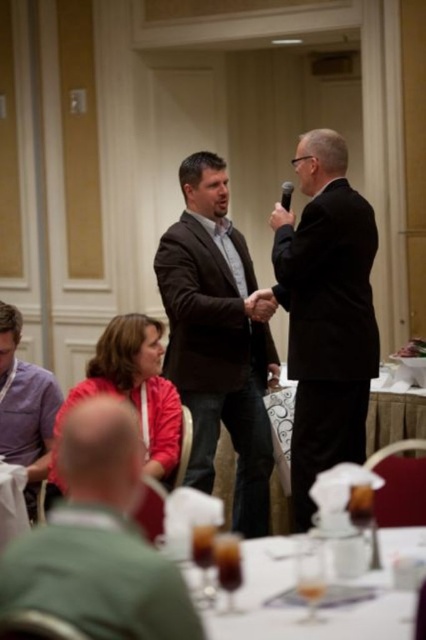
Question: Is green fabric shirt at lower left bigger than white glossy table at center?

Choices:
 (A) yes
 (B) no

Answer: (A)

Question: Which object is farther from the camera taking this photo?

Choices:
 (A) white glossy table at center
 (B) black suit at center
 (C) green fabric shirt at lower left

Answer: (A)

Question: Is black suit at center to the right of white glossy table at center from the viewer's perspective?

Choices:
 (A) no
 (B) yes

Answer: (B)

Question: Which of the following is the closest to the observer?

Choices:
 (A) (282, 204)
 (B) (334, 625)
 (C) (2, 333)

Answer: (B)

Question: Is matte brown suit at center wider than black plastic microphone at upper center?

Choices:
 (A) no
 (B) yes

Answer: (B)

Question: Which of these objects is positioned closest to the black plastic microphone at upper center?

Choices:
 (A) matte brown suit at center
 (B) clear glassware at lower center
 (C) green fabric shirt at lower left
 (D) black suit at center

Answer: (D)